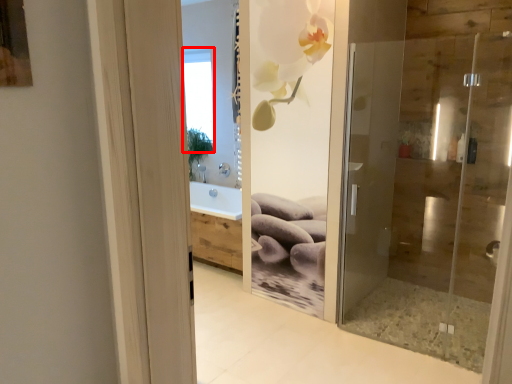
Question: From the image, what is the correct spatial relationship of window (annotated by the red box) in relation to door?

Choices:
 (A) right
 (B) left

Answer: (B)